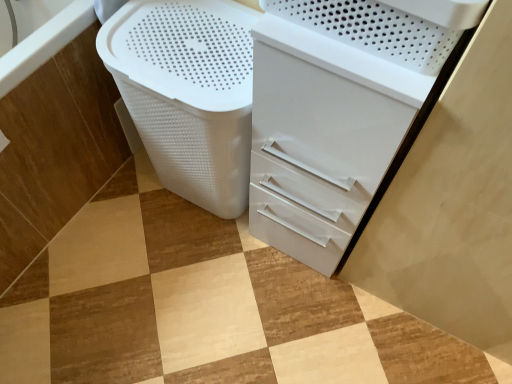
You are a GUI agent. You are given a task and a screenshot of the screen. Output one action in this format:
    pyautogui.click(x=<x>, y=<y>)
    Task: Click on the vacant area that lies to the right of white plastic basket at lower left
    The height and width of the screenshot is (384, 512).
    Given the screenshot: What is the action you would take?
    pyautogui.click(x=162, y=240)